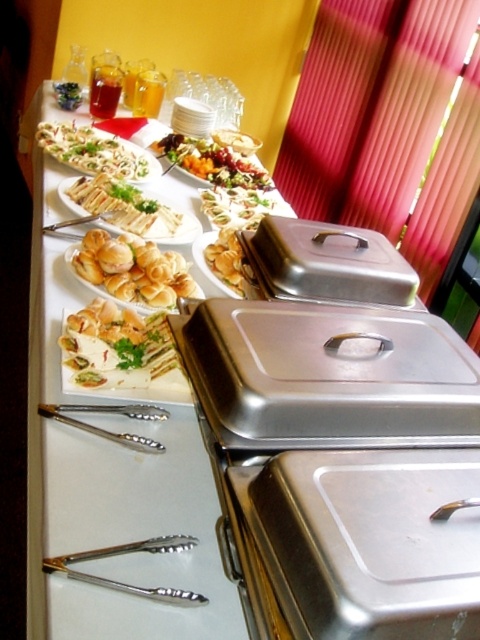
Does translucent glass juice at upper left appear on the left side of green leafy vegetable at upper left?

In fact, translucent glass juice at upper left is to the right of green leafy vegetable at upper left.

Is translucent glass juice at upper left further to camera compared to green leafy vegetable at upper left?

No, translucent glass juice at upper left is closer to the viewer.

This screenshot has height=640, width=480. Identify the location of translucent glass juice at upper left. (105, 90).

Does matte brown bread at center have a greater height compared to green leafy salad at center?

Correct, matte brown bread at center is much taller as green leafy salad at center.

Which is in front, point (86, 140) or point (240, 208)?

Point (240, 208)

Identify the location of matte brown bread at center. The width and height of the screenshot is (480, 640). (94, 150).

Find the location of a particular element. matte brown bread at center is located at coordinates (94, 150).

Does shiny silver platter at center have a lesser height compared to green leafy vegetable at upper left?

In fact, shiny silver platter at center may be taller than green leafy vegetable at upper left.

Does shiny silver platter at center appear over green leafy vegetable at upper left?

Incorrect, shiny silver platter at center is not positioned above green leafy vegetable at upper left.

Identify the location of shiny silver platter at center. (213, 163).